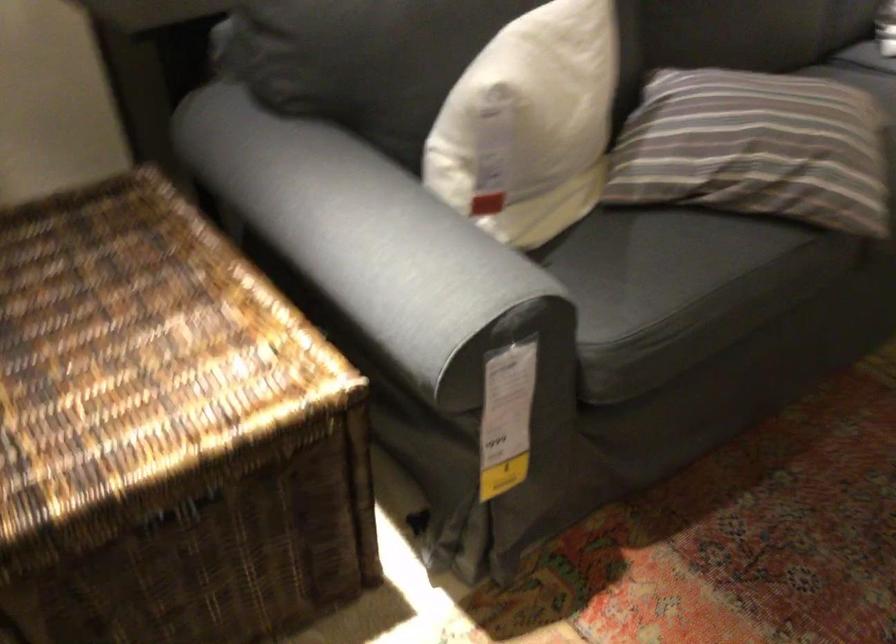
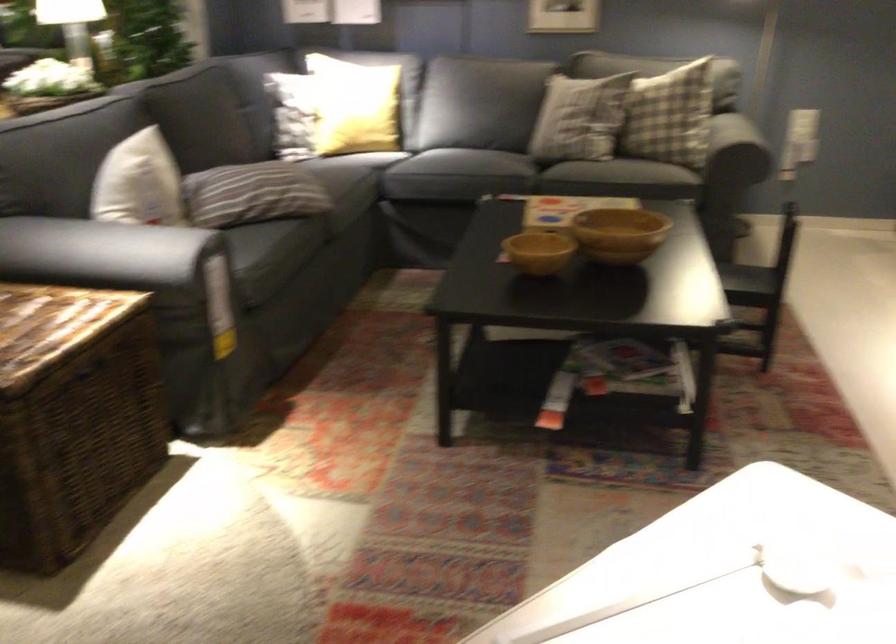
Where in the second image is the point corresponding to point (359, 263) from the first image?

(117, 252)